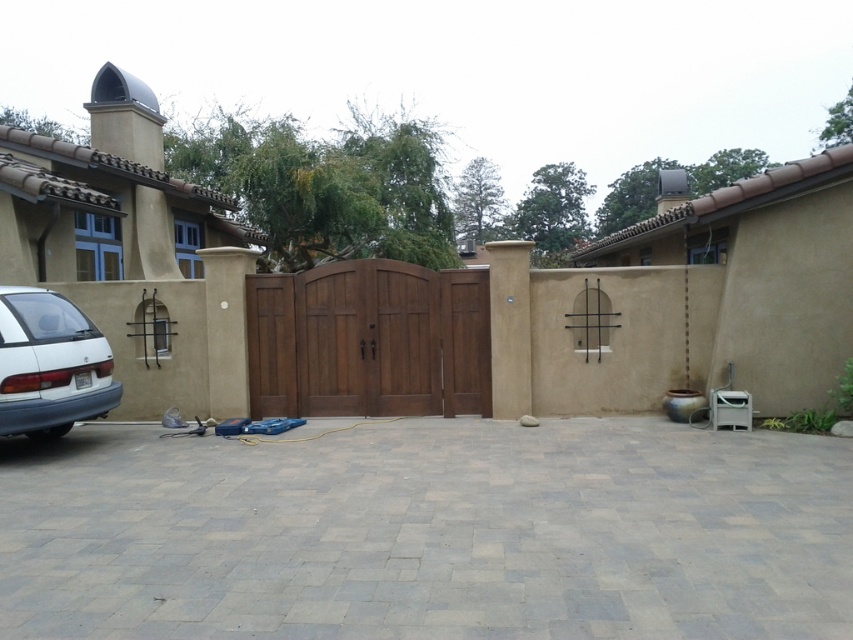
Question: Which of the following is the closest to the observer?

Choices:
 (A) (643, 604)
 (B) (277, 392)

Answer: (A)

Question: Which object is farther from the camera taking this photo?

Choices:
 (A) wooden gate at center
 (B) brown wooden gate at center
 (C) gray paver driveway at center
 (D) white matte hatchback at lower left

Answer: (A)

Question: Is brown wooden door at center to the right of wooden gate at center from the viewer's perspective?

Choices:
 (A) no
 (B) yes

Answer: (B)

Question: Which point is closer to the camera?

Choices:
 (A) gray paver driveway at center
 (B) white matte hatchback at lower left
 (C) brown wooden gate at center

Answer: (A)

Question: Is gray paver driveway at center below brown wooden gate at center?

Choices:
 (A) no
 (B) yes

Answer: (B)

Question: Does white matte hatchback at lower left have a greater width compared to wooden gate at center?

Choices:
 (A) yes
 (B) no

Answer: (A)